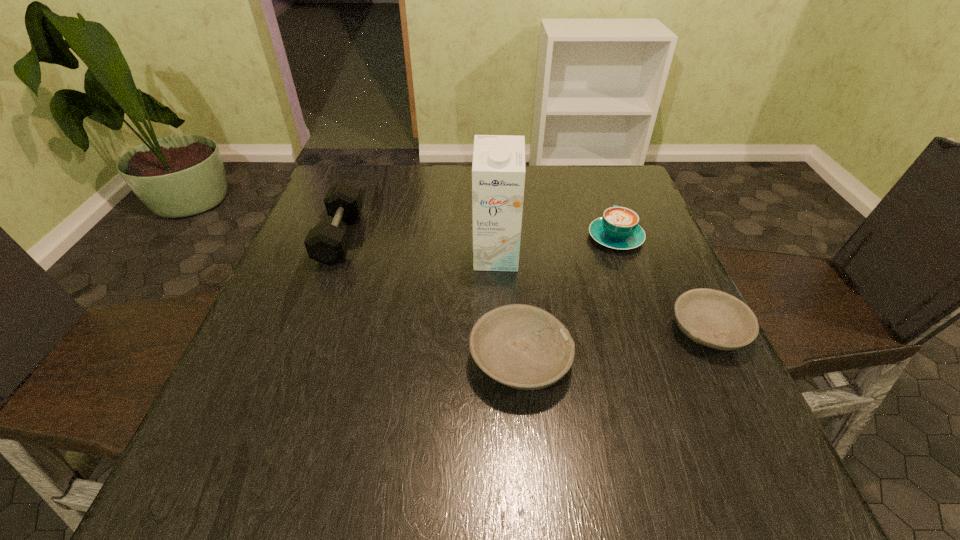
This screenshot has height=540, width=960. I want to click on blank space located on the front of the dumbbell, so click(x=297, y=353).

Where is `free location located with the handle on the right side of the cappuccino`? The image size is (960, 540). free location located with the handle on the right side of the cappuccino is located at coordinates (601, 198).

At what (x,y) coordinates should I click in order to perform the action: click on vacant region located with the handle on the right side of the cappuccino. Please return your answer as a coordinate pair (x, y). The width and height of the screenshot is (960, 540). Looking at the image, I should click on (604, 206).

I want to click on vacant region located 0.270m with the handle on the right side of the cappuccino, so click(x=590, y=169).

Image resolution: width=960 pixels, height=540 pixels. What are the coordinates of `object that is positioned at the near edge` in the screenshot? It's located at (521, 346).

Identify the location of object that is at the left edge. The width and height of the screenshot is (960, 540). (327, 243).

Find the location of `bowl that is at the right edge`. bowl that is at the right edge is located at coordinates (713, 318).

I want to click on cappuccino that is at the right edge, so click(x=618, y=229).

The width and height of the screenshot is (960, 540). I want to click on vacant space at the far edge of the desktop, so click(555, 166).

Image resolution: width=960 pixels, height=540 pixels. What are the coordinates of `free space at the near edge of the desktop` in the screenshot? It's located at click(629, 431).